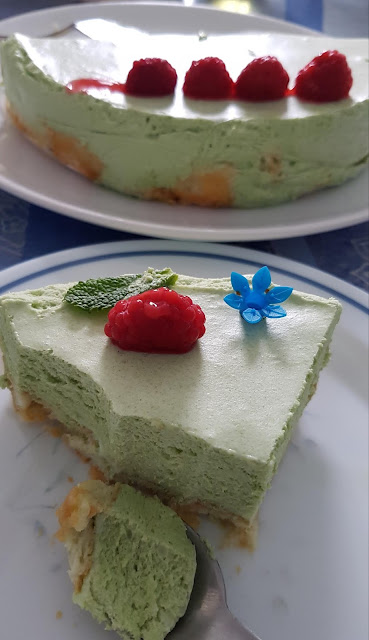
Find the location of a particular element. This screenshot has width=369, height=640. spoon is located at coordinates (204, 593).